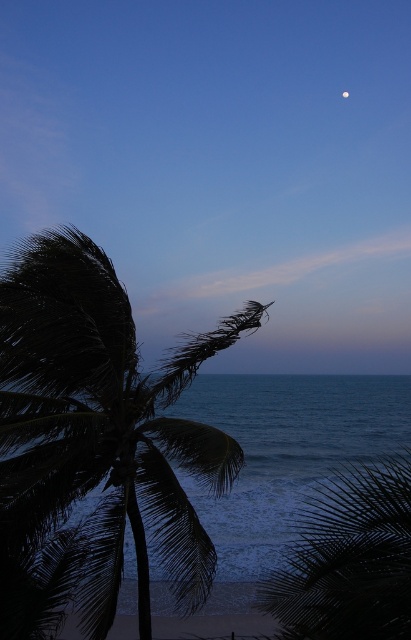
Question: Estimate the real-world distances between objects in this image. Which object is closer to the dark green leafy palm at left?

Choices:
 (A) silvery reflective moon at upper right
 (B) dark green leafy coconut tree at lower right

Answer: (B)

Question: Is dark green leafy palm at left to the left of dark green leafy coconut tree at lower right from the viewer's perspective?

Choices:
 (A) yes
 (B) no

Answer: (A)

Question: Does dark green leafy coconut tree at lower right lie in front of silvery reflective moon at upper right?

Choices:
 (A) yes
 (B) no

Answer: (A)

Question: Can you confirm if dark green leafy palm at left is positioned to the left of silvery reflective moon at upper right?

Choices:
 (A) no
 (B) yes

Answer: (B)

Question: Which point appears farthest from the camera in this image?

Choices:
 (A) (371, 515)
 (B) (62, 240)

Answer: (B)

Question: Among these objects, which one is nearest to the camera?

Choices:
 (A) silvery reflective moon at upper right
 (B) dark green leafy palm at left
 (C) dark green leafy coconut tree at lower right

Answer: (C)